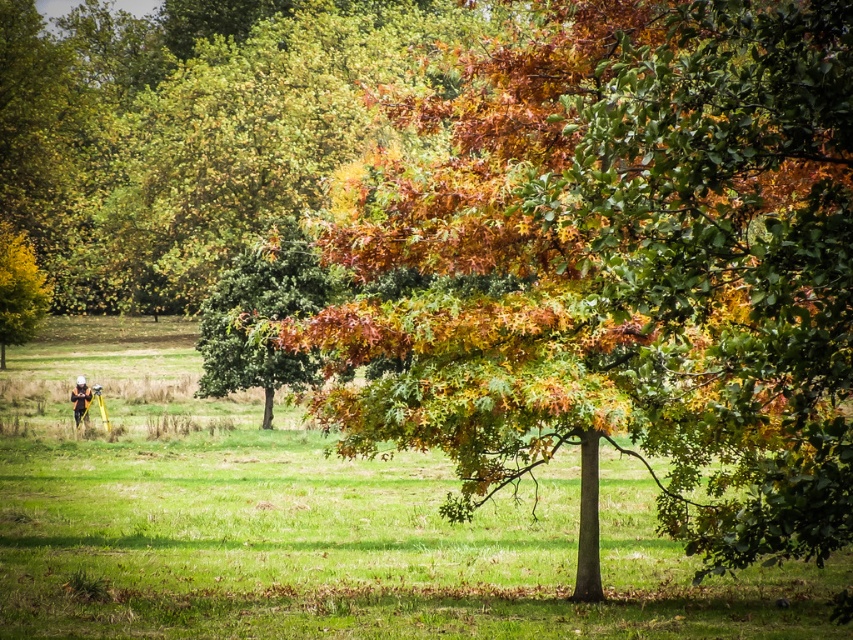
Question: Which point is closer to the camera?

Choices:
 (A) multicolored foliage at center
 (B) green leafy tree at center

Answer: (A)

Question: Can you confirm if multicolored foliage at center is thinner than golden yellow leaves at left?

Choices:
 (A) yes
 (B) no

Answer: (B)

Question: Can you confirm if multicolored foliage at center is positioned below green leafy tree at center?

Choices:
 (A) no
 (B) yes

Answer: (A)

Question: Is green leafy tree at center to the left of golden yellow leaves at left from the viewer's perspective?

Choices:
 (A) no
 (B) yes

Answer: (A)

Question: Among these objects, which one is nearest to the camera?

Choices:
 (A) orange-clothed person at lower left
 (B) golden yellow leaves at left
 (C) green leafy tree at center
 (D) multicolored foliage at center

Answer: (D)

Question: Among these objects, which one is farthest from the camera?

Choices:
 (A) multicolored foliage at center
 (B) orange-clothed person at lower left

Answer: (B)